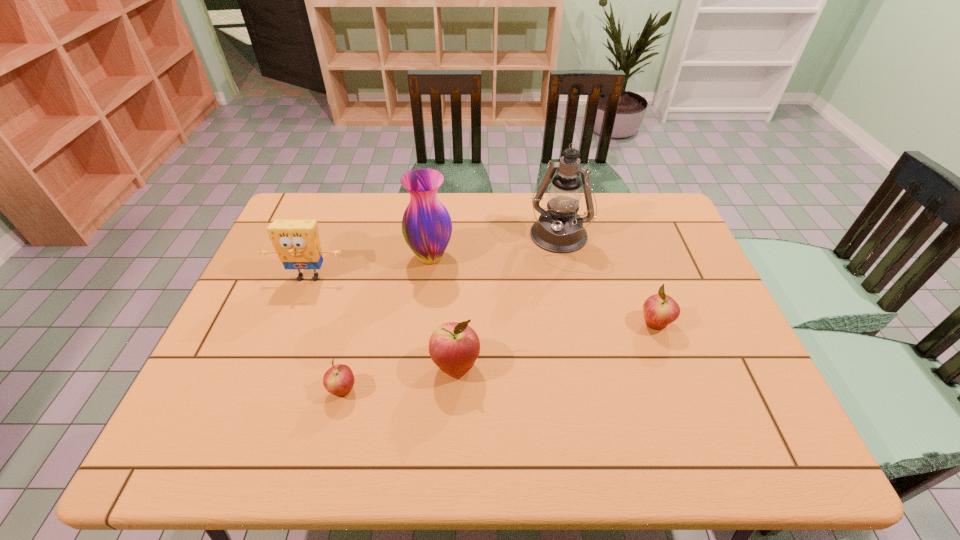
This screenshot has width=960, height=540. In the image, there is a desktop. In order to click on vacant region at the far right corner in this screenshot , I will do `click(662, 214)`.

Find the location of a particular element. vacant area between the second apple from left to right and the sponge is located at coordinates (382, 321).

Where is `vacant area between the fifth tallest object and the second apple from left to right`? This screenshot has width=960, height=540. vacant area between the fifth tallest object and the second apple from left to right is located at coordinates (555, 345).

Image resolution: width=960 pixels, height=540 pixels. Find the location of `free space that is in between the second object from left to right and the tallest apple`. free space that is in between the second object from left to right and the tallest apple is located at coordinates (399, 377).

Locate an element on the screen. The image size is (960, 540). free spot between the farthest apple and the shortest object is located at coordinates (499, 356).

This screenshot has height=540, width=960. I want to click on empty space between the leftmost object and the tallest apple, so click(x=382, y=321).

At what (x,y) coordinates should I click in order to perform the action: click on vacant region between the oil lamp and the third nearest object. Please return your answer as a coordinate pair (x, y). Looking at the image, I should click on (606, 281).

You are a GUI agent. You are given a task and a screenshot of the screen. Output one action in this format:
    pyautogui.click(x=<x>, y=<y>)
    Task: Click on the vacant area between the second apple from left to right and the leftmost object
    Image resolution: width=960 pixels, height=540 pixels.
    Given the screenshot: What is the action you would take?
    pyautogui.click(x=382, y=321)

Find the location of `unoccupied area between the oil lamp and the second shortest object`. unoccupied area between the oil lamp and the second shortest object is located at coordinates (606, 281).

Where is `vacant space in between the second apple from right to left and the fifth shortest object`? Image resolution: width=960 pixels, height=540 pixels. vacant space in between the second apple from right to left and the fifth shortest object is located at coordinates (444, 311).